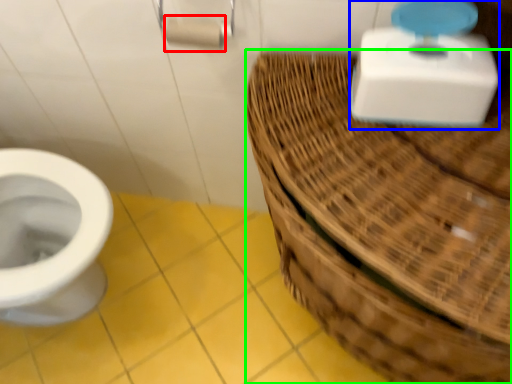
Question: Considering the real-world distances, which object is farthest from toilet paper (highlighted by a red box)? scale (highlighted by a blue box) or basket (highlighted by a green box)?

Choices:
 (A) scale
 (B) basket

Answer: (B)